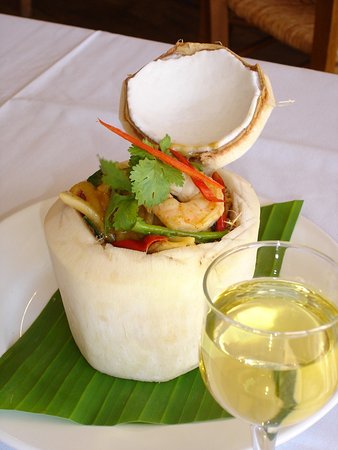
The width and height of the screenshot is (338, 450). Find the location of `chair`. chair is located at coordinates (214, 27).